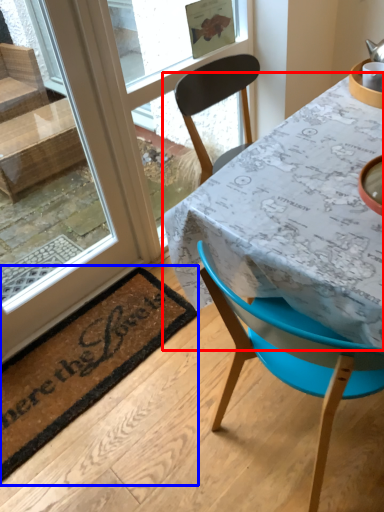
Question: Which point is closer to the camera, table (highlighted by a red box) or mat (highlighted by a blue box)?

Choices:
 (A) table
 (B) mat

Answer: (A)